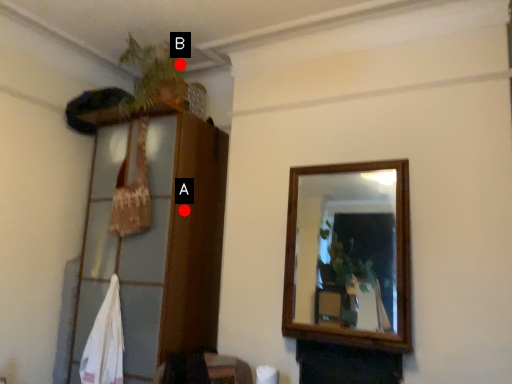
Question: Two points are circled on the image, labeled by A and B beside each circle. Which point is closer to the camera taking this photo?

Choices:
 (A) A is closer
 (B) B is closer

Answer: (A)